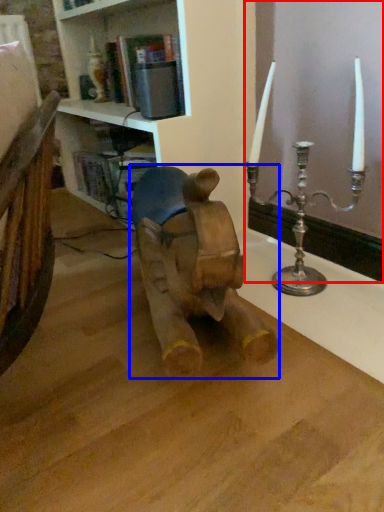
Question: Which object appears farthest to the camera in this image, window frame (highlighted by a red box) or animal (highlighted by a blue box)?

Choices:
 (A) window frame
 (B) animal

Answer: (A)